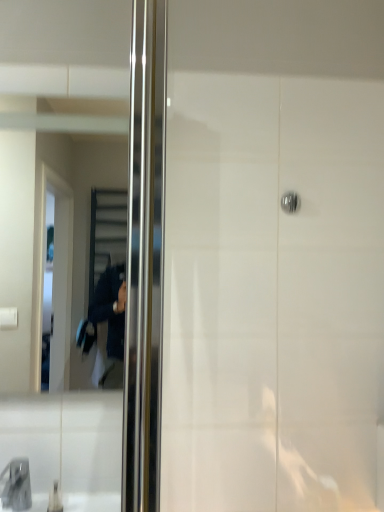
Question: Does metallic reflective mirror at left come behind satin chrome door handle at upper center?

Choices:
 (A) yes
 (B) no

Answer: (B)

Question: Does metallic reflective mirror at left contain satin chrome door handle at upper center?

Choices:
 (A) yes
 (B) no

Answer: (B)

Question: Does metallic reflective mirror at left have a greater width compared to satin chrome door handle at upper center?

Choices:
 (A) no
 (B) yes

Answer: (B)

Question: From the image's perspective, is metallic reflective mirror at left on top of satin chrome door handle at upper center?

Choices:
 (A) no
 (B) yes

Answer: (A)

Question: Is metallic reflective mirror at left oriented towards satin chrome door handle at upper center?

Choices:
 (A) no
 (B) yes

Answer: (A)

Question: Does metallic reflective mirror at left appear on the right side of satin chrome door handle at upper center?

Choices:
 (A) no
 (B) yes

Answer: (A)

Question: Is metallic reflective mirror at left taller than matte gray faucet at lower left?

Choices:
 (A) no
 (B) yes

Answer: (B)

Question: Is metallic reflective mirror at left oriented towards matte gray faucet at lower left?

Choices:
 (A) yes
 (B) no

Answer: (B)

Question: From a real-world perspective, is metallic reflective mirror at left positioned over matte gray faucet at lower left based on gravity?

Choices:
 (A) no
 (B) yes

Answer: (B)

Question: Is metallic reflective mirror at left next to matte gray faucet at lower left?

Choices:
 (A) yes
 (B) no

Answer: (B)

Question: Is metallic reflective mirror at left at the right side of matte gray faucet at lower left?

Choices:
 (A) yes
 (B) no

Answer: (A)

Question: From the image's perspective, is metallic reflective mirror at left below matte gray faucet at lower left?

Choices:
 (A) yes
 (B) no

Answer: (B)

Question: Would you consider matte gray faucet at lower left to be distant from metallic reflective mirror at left?

Choices:
 (A) yes
 (B) no

Answer: (B)